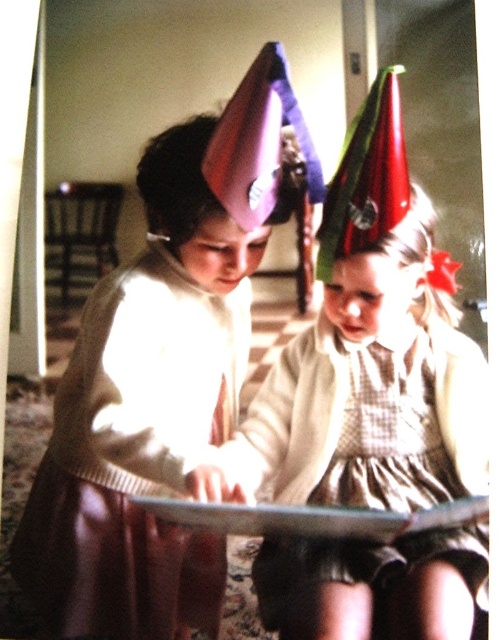
Is matte white sweater at center taller than checkered fabric dress at center?

Yes.

Who is lower down, matte white sweater at center or checkered fabric dress at center?

checkered fabric dress at center is lower down.

Between point (125, 605) and point (455, 452), which one is positioned behind?

Positioned behind is point (455, 452).

At what (x,y) coordinates should I click in order to perform the action: click on matte white sweater at center. Please return your answer as a coordinate pair (x, y). Image resolution: width=501 pixels, height=640 pixels. Looking at the image, I should click on (143, 417).